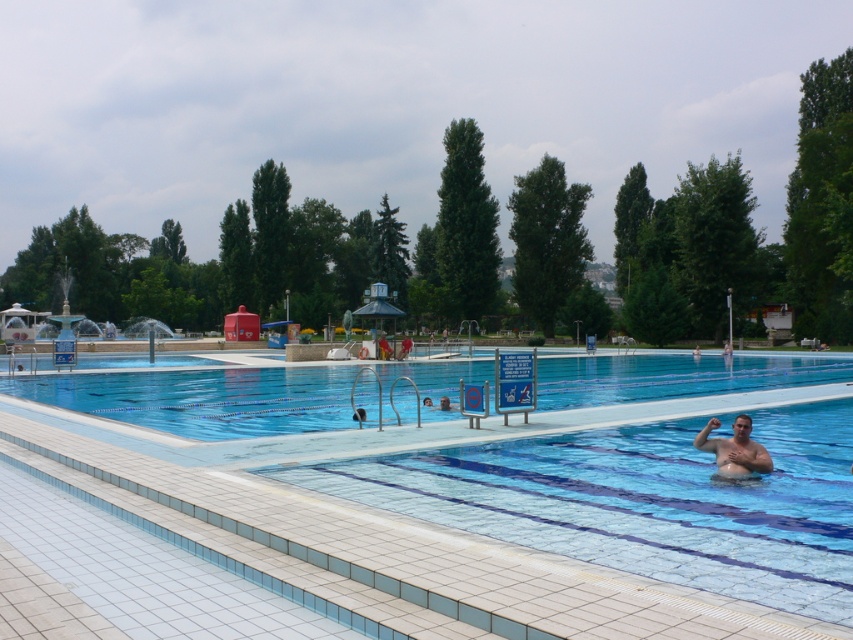
You are a lifeguard on duty at the pool. You see the transparent glass pool at center and the skinny man at center. Which object is closer to you, the observer?

The transparent glass pool at center is closer to you than the skinny man at center because the skinny man at center is behind the transparent glass pool at center.

You are a lifeguard on duty at the pool. You notice a point marked at coordinates (431, 508) in the image. What object is located at that point?

The point at coordinates (431, 508) corresponds to the clear blue tiles at center.